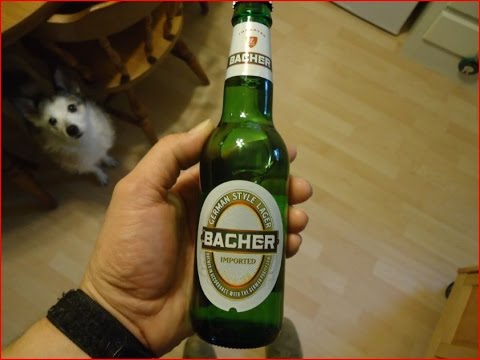
Where is `table`? This screenshot has width=480, height=360. table is located at coordinates (22, 15).